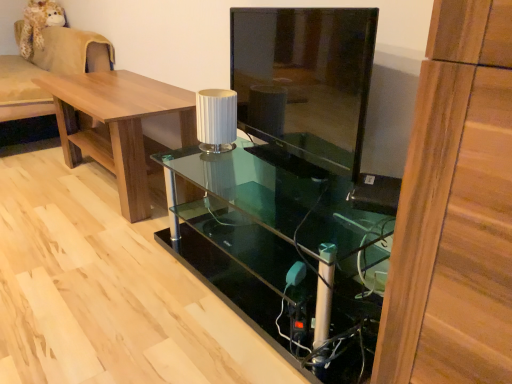
Question: Can you confirm if transparent glass desk at center is positioned to the left of white ribbed lampshade at center?

Choices:
 (A) yes
 (B) no

Answer: (B)

Question: From the image's perspective, is transparent glass desk at center over white ribbed lampshade at center?

Choices:
 (A) no
 (B) yes

Answer: (A)

Question: From a real-world perspective, does transparent glass desk at center stand above white ribbed lampshade at center?

Choices:
 (A) no
 (B) yes

Answer: (A)

Question: Is transparent glass desk at center not inside white ribbed lampshade at center?

Choices:
 (A) no
 (B) yes

Answer: (B)

Question: Considering the relative sizes of transparent glass desk at center and white ribbed lampshade at center in the image provided, is transparent glass desk at center thinner than white ribbed lampshade at center?

Choices:
 (A) no
 (B) yes

Answer: (A)

Question: From a real-world perspective, is transparent glass desk at center physically below white ribbed lampshade at center?

Choices:
 (A) no
 (B) yes

Answer: (B)

Question: Is transparent glass tv stand at center completely or partially outside of beige fabric couch at left?

Choices:
 (A) yes
 (B) no

Answer: (A)

Question: Considering the relative sizes of transparent glass tv stand at center and beige fabric couch at left in the image provided, is transparent glass tv stand at center wider than beige fabric couch at left?

Choices:
 (A) no
 (B) yes

Answer: (A)

Question: Does transparent glass tv stand at center have a greater height compared to beige fabric couch at left?

Choices:
 (A) no
 (B) yes

Answer: (A)

Question: Does transparent glass tv stand at center have a lesser width compared to beige fabric couch at left?

Choices:
 (A) yes
 (B) no

Answer: (A)

Question: From the image's perspective, would you say transparent glass tv stand at center is shown under beige fabric couch at left?

Choices:
 (A) no
 (B) yes

Answer: (B)

Question: Does transparent glass tv stand at center have a larger size compared to beige fabric couch at left?

Choices:
 (A) yes
 (B) no

Answer: (B)

Question: From the image's perspective, would you say beige fabric couch at left is positioned over brown wood table at left?

Choices:
 (A) yes
 (B) no

Answer: (A)